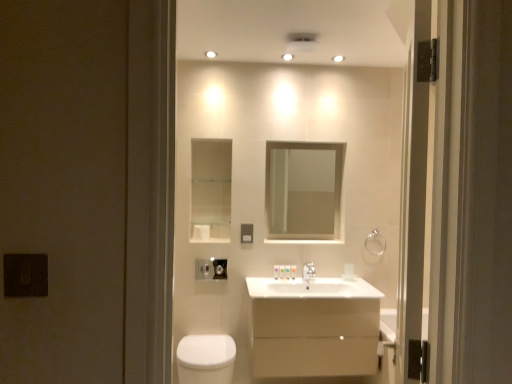
Question: Does white glossy toiletries at center, the second toiletry viewed from the left, have a lesser height compared to satin nickel faucet at center?

Choices:
 (A) yes
 (B) no

Answer: (A)

Question: Is white glossy toiletries at center, acting as the 1th toiletry starting from the right, to the right of satin nickel faucet at center from the viewer's perspective?

Choices:
 (A) yes
 (B) no

Answer: (B)

Question: From the image's perspective, is white glossy toiletries at center, the second toiletry viewed from the left, below satin nickel faucet at center?

Choices:
 (A) no
 (B) yes

Answer: (B)

Question: Does white glossy toiletries at center, the second toiletry viewed from the left, have a lesser width compared to satin nickel faucet at center?

Choices:
 (A) no
 (B) yes

Answer: (B)

Question: Does white glossy toiletries at center, acting as the 1th toiletry starting from the right, lie in front of satin nickel faucet at center?

Choices:
 (A) yes
 (B) no

Answer: (B)

Question: Based on their positions, is white matte toilet paper at center located to the left or right of silver metallic towel bar at upper right?

Choices:
 (A) right
 (B) left

Answer: (B)

Question: From the image's perspective, is white matte toilet paper at center above or below silver metallic towel bar at upper right?

Choices:
 (A) below
 (B) above

Answer: (B)

Question: Is white matte toilet paper at center bigger or smaller than silver metallic towel bar at upper right?

Choices:
 (A) small
 (B) big

Answer: (B)

Question: Considering their positions, is white matte toilet paper at center located in front of or behind silver metallic towel bar at upper right?

Choices:
 (A) behind
 (B) front

Answer: (B)

Question: Choose the correct answer: Is white glossy cabinet at center inside white matte toilet paper at center or outside it?

Choices:
 (A) outside
 (B) inside

Answer: (A)

Question: In the image, is white glossy cabinet at center on the left side or the right side of white matte toilet paper at center?

Choices:
 (A) left
 (B) right

Answer: (B)

Question: Considering the positions of white glossy cabinet at center and white matte toilet paper at center in the image, is white glossy cabinet at center wider or thinner than white matte toilet paper at center?

Choices:
 (A) wide
 (B) thin

Answer: (A)

Question: From their relative heights in the image, would you say white glossy cabinet at center is taller or shorter than white matte toilet paper at center?

Choices:
 (A) short
 (B) tall

Answer: (B)

Question: Is point pyautogui.click(x=195, y=238) positioned closer to the camera than point pyautogui.click(x=325, y=230)?

Choices:
 (A) closer
 (B) farther

Answer: (A)

Question: Based on their sizes in the image, would you say white matte toilet paper at center is bigger or smaller than clear glass mirror at upper center?

Choices:
 (A) small
 (B) big

Answer: (A)